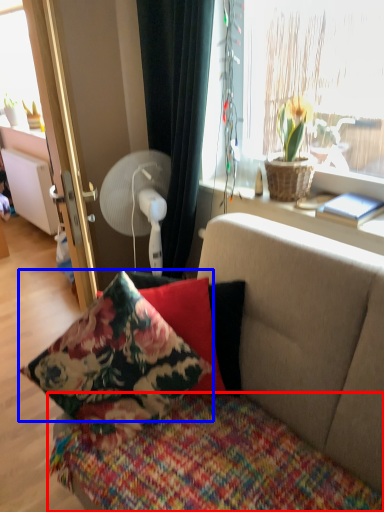
Question: Among these objects, which one is farthest to the camera, bedcover (highlighted by a red box) or pillow (highlighted by a blue box)?

Choices:
 (A) bedcover
 (B) pillow

Answer: (B)